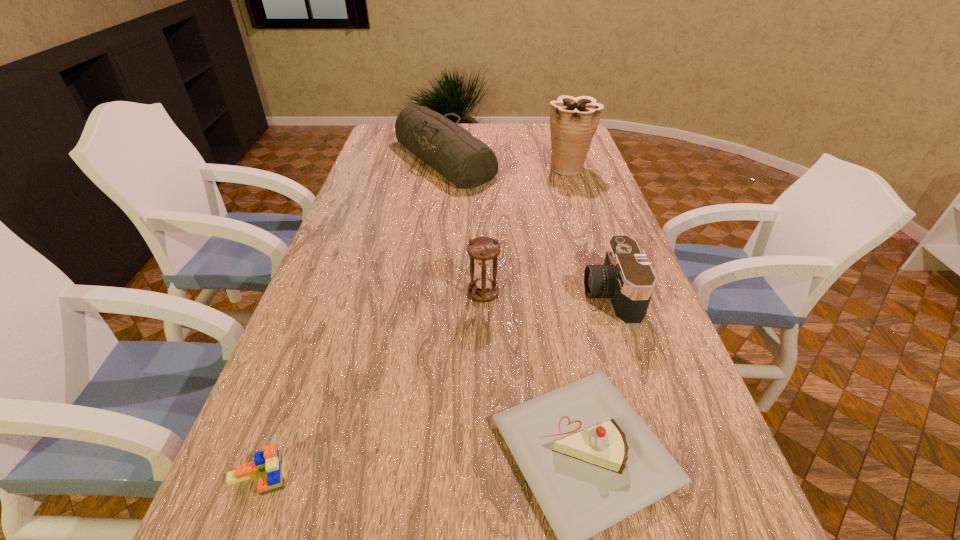
Identify the location of free space located on the front-facing side of the third shortest object. (550, 295).

Locate an element on the screen. This screenshot has width=960, height=540. free space located 0.160m on the right of the Lego is located at coordinates (375, 477).

Where is `object that is at the far edge`? This screenshot has width=960, height=540. object that is at the far edge is located at coordinates (466, 161).

What are the coordinates of `duffel bag at the left edge` in the screenshot? It's located at [466, 161].

In order to click on Lego located in the left edge section of the desktop in this screenshot , I will do `click(270, 461)`.

At what (x,y) coordinates should I click in order to perform the action: click on urn that is at the right edge. Please return your answer as a coordinate pair (x, y). This screenshot has height=540, width=960. Looking at the image, I should click on (573, 121).

At what (x,y) coordinates should I click in order to perform the action: click on camera situated at the right edge. Please return your answer as a coordinate pair (x, y). The height and width of the screenshot is (540, 960). Looking at the image, I should click on (626, 278).

In order to click on object at the far left corner in this screenshot , I will do `click(466, 161)`.

Where is `free space at the far edge of the desktop`? The height and width of the screenshot is (540, 960). free space at the far edge of the desktop is located at coordinates (479, 124).

In the image, there is a desktop. Where is `vacant space at the left edge`? The height and width of the screenshot is (540, 960). vacant space at the left edge is located at coordinates click(348, 306).